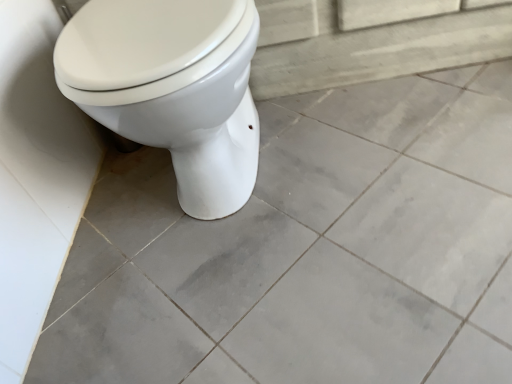
This screenshot has width=512, height=384. In order to click on empty space that is to the right of white glossy toilet at center in this screenshot , I will do `click(378, 152)`.